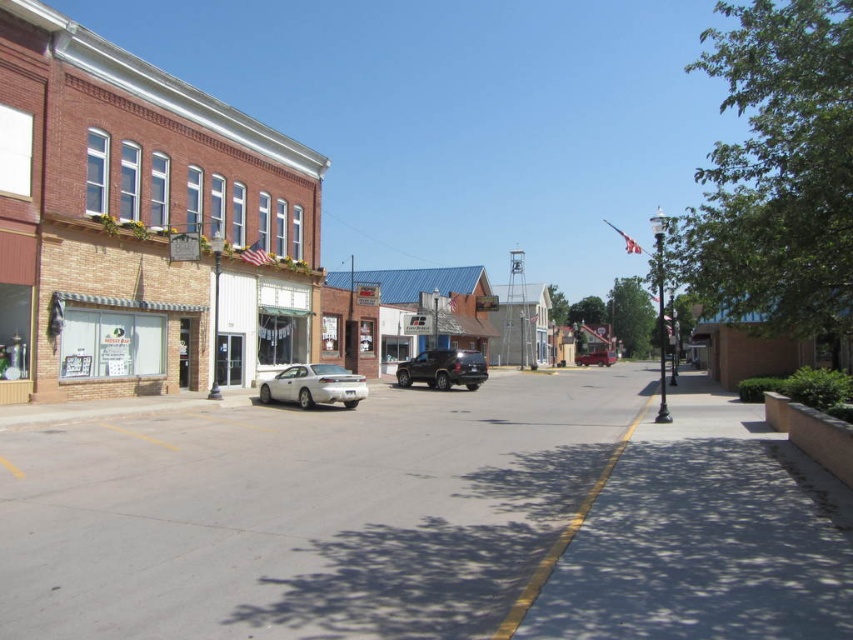
Question: Among these points, which one is nearest to the camera?

Choices:
 (A) (296, 397)
 (B) (465, 364)
 (C) (593, 358)

Answer: (A)

Question: Does matte black truck at center have a lesser width compared to matte black suv at center?

Choices:
 (A) no
 (B) yes

Answer: (B)

Question: Among these points, which one is farthest from the camera?

Choices:
 (A) (608, 355)
 (B) (325, 385)
 (C) (479, 380)

Answer: (A)

Question: Can you confirm if satin silver sedan at center is positioned to the right of matte black suv at center?

Choices:
 (A) yes
 (B) no

Answer: (B)

Question: Observing the image, what is the correct spatial positioning of satin silver sedan at center in reference to matte black truck at center?

Choices:
 (A) below
 (B) above

Answer: (B)

Question: Which object is positioned farthest from the matte black suv at center?

Choices:
 (A) satin silver sedan at center
 (B) matte black truck at center

Answer: (A)